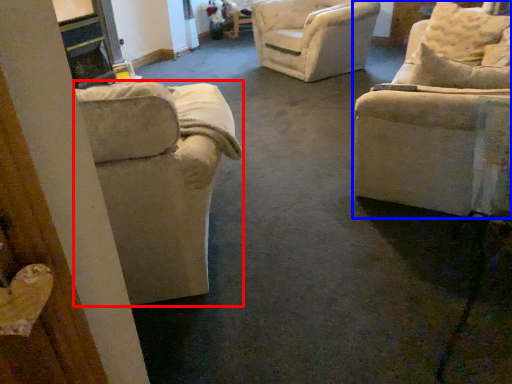
Question: Which object is closer to the camera taking this photo, chair (highlighted by a red box) or chair (highlighted by a blue box)?

Choices:
 (A) chair
 (B) chair

Answer: (A)